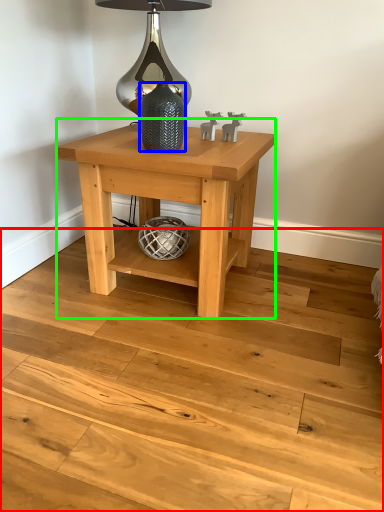
Question: Which object is positioned closest to stair (highlighted by a red box)? Select from glass vase (highlighted by a blue box) and table (highlighted by a green box).

Choices:
 (A) glass vase
 (B) table

Answer: (B)